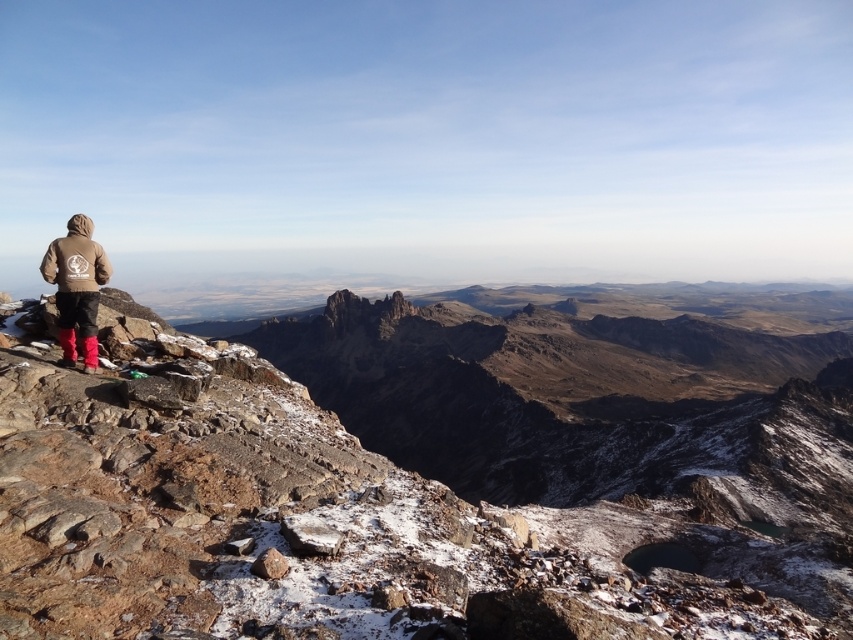
You are standing at the point labeled point (793, 321) and want to walk to the summit. The path is straight and clear. If you walk at a steady pace of 3 meters per second, how many minutes will it take you to reach the summit?

The distance between point (793, 321) and the viewer is 721.63 meters. Since the path is straight and clear, it will take approximately 721.63 meters divided by 3 meters per second equals 240.54 seconds, which is about 4 minutes to reach the summit.

You are a photographer trying to capture the brown rocky mountain at left and the brown suede jacket at lower left in a single frame. Which object will appear larger in the photo?

The brown rocky mountain at left will appear larger in the photo because it is bigger than the brown suede jacket at lower left.

You are a hiker standing at the base of the brown rocky mountain at left wearing a brown suede jacket at lower left. You want to reach the summit. Given that the average human walking speed is 3 mph, how many minutes will it take you to reach the summit if you walk straight towards it?

The distance of brown rocky mountain at left from brown suede jacket at lower left is 863.77 feet. Converting this distance to miles, 863.77 feet is approximately 0.164 miles. At a walking speed of 3 mph, the time required would be approximately 0.164 miles divided by 3 mph, which equals roughly 0.0547 hours. Converting hours to minutes by multiplying by 60, this results in approximately 3.28 minutes. However, this calculation assumes a straight path and does not account for terrain difficulty or elevation,